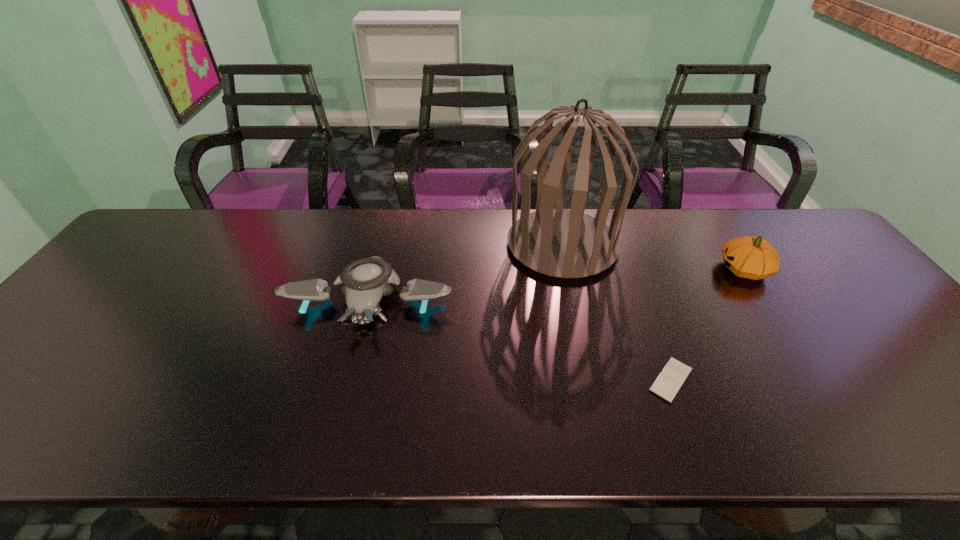
Locate an element on the screen. This screenshot has width=960, height=540. vacant space that is in between the birdcage and the rightmost object is located at coordinates (653, 257).

Locate an element on the screen. The height and width of the screenshot is (540, 960). vacant region between the drone and the tallest object is located at coordinates (466, 272).

Locate an element on the screen. This screenshot has height=540, width=960. object that is the closest one to the diary is located at coordinates (561, 243).

Image resolution: width=960 pixels, height=540 pixels. I want to click on object that can be found as the second closest to the drone, so pos(670,380).

At what (x,y) coordinates should I click in order to perform the action: click on vacant space that satisfies the following two spatial constraints: 1. on the front-facing side of the third tallest object; 2. on the right side of the shortest object. Please return your answer as a coordinate pair (x, y). Looking at the image, I should click on (349, 380).

This screenshot has width=960, height=540. Find the location of `free space in the image that satisfies the following two spatial constraints: 1. on the side of the rightmost object with the carved face; 2. on the front-facing side of the drone`. free space in the image that satisfies the following two spatial constraints: 1. on the side of the rightmost object with the carved face; 2. on the front-facing side of the drone is located at coordinates (763, 300).

This screenshot has height=540, width=960. I want to click on free spot that satisfies the following two spatial constraints: 1. on the front side of the shortest object; 2. on the right side of the tallest object, so point(591,380).

Where is `free space that satisfies the following two spatial constraints: 1. on the side of the gourd with the carved face; 2. on the front-facing side of the drone`? The width and height of the screenshot is (960, 540). free space that satisfies the following two spatial constraints: 1. on the side of the gourd with the carved face; 2. on the front-facing side of the drone is located at coordinates (x=763, y=300).

Identify the location of vacant space that satisfies the following two spatial constraints: 1. on the front-facing side of the drone; 2. on the right side of the nearest object. (349, 380).